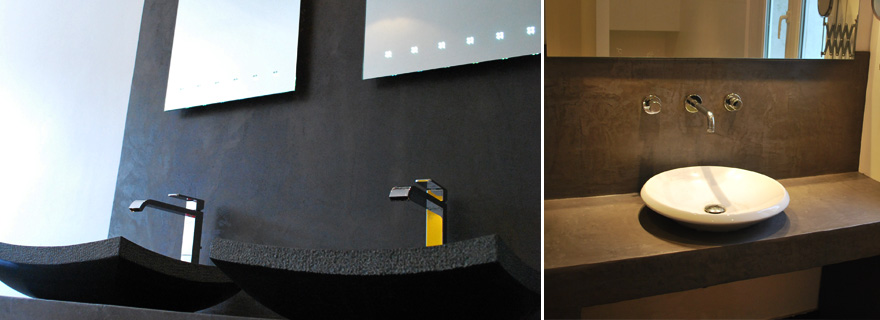
This screenshot has width=880, height=320. I want to click on mirrors, so click(222, 43), click(402, 33), click(744, 13).